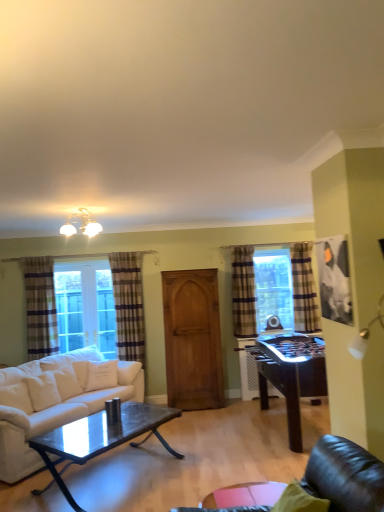
Describe the element at coordinates (304, 289) in the screenshot. I see `plaid fabric curtain at right, the fourth curtain positioned from the left` at that location.

What do you see at coordinates (243, 292) in the screenshot? I see `plaid fabric curtain at center, the 2th curtain when ordered from right to left` at bounding box center [243, 292].

Locate an element on the screen. wooden armoire at center is located at coordinates (192, 339).

Find the location of a particular element. The image size is (384, 512). plaid fabric curtain at left, arranged as the 1th curtain when viewed from the left is located at coordinates (40, 306).

The width and height of the screenshot is (384, 512). What do you see at coordinates (16, 397) in the screenshot?
I see `white soft pillow at lower left, acting as the 2th pillow starting from the back` at bounding box center [16, 397].

Locate an element on the screen. shiny dark wood coffee table at center is located at coordinates (101, 437).

The height and width of the screenshot is (512, 384). Identify the location of plaid fabric curtain at right, the fourth curtain positioned from the left. (304, 289).

The image size is (384, 512). There is a white fabric couch at lower left. What are the coordinates of `the 2nd pillow above it (from a real-world perspective)` in the screenshot? It's located at [x=101, y=375].

From a real-world perspective, is white cotton pillow at lower left, arranged as the 1th pillow when viewed from the back, located beneath white fabric couch at lower left?

No, from a real-world perspective, white cotton pillow at lower left, arranged as the 1th pillow when viewed from the back, is not under white fabric couch at lower left.

Is white cotton pillow at lower left, the second pillow when ordered from front to back, facing towards white fabric couch at lower left?

Yes, white cotton pillow at lower left, the second pillow when ordered from front to back, is turned towards white fabric couch at lower left.

Is white cotton pillow at lower left, placed as the first pillow when sorted from right to left, taller or shorter than white fabric couch at lower left?

In the image, white cotton pillow at lower left, placed as the first pillow when sorted from right to left, appears to be shorter than white fabric couch at lower left.

Where is `light fixture lying above the wooden armoire at center (from the image's perspective)`? Image resolution: width=384 pixels, height=512 pixels. light fixture lying above the wooden armoire at center (from the image's perspective) is located at coordinates (82, 225).

Is wooden armoire at center far away from matte white chandelier at upper center?

Yes, wooden armoire at center and matte white chandelier at upper center are quite far apart.

Considering the sizes of objects wooden armoire at center and matte white chandelier at upper center in the image provided, who is smaller, wooden armoire at center or matte white chandelier at upper center?

Smaller between the two is matte white chandelier at upper center.

Is transparent glass table at lower center located outside white cotton pillow at lower left, the second pillow when ordered from front to back?

Indeed, transparent glass table at lower center is completely outside white cotton pillow at lower left, the second pillow when ordered from front to back.

Is transparent glass table at lower center with white cotton pillow at lower left, placed as the first pillow when sorted from right to left?

They are not placed beside each other.

Is transparent glass table at lower center shorter than white cotton pillow at lower left, placed as the first pillow when sorted from right to left?

Yes, transparent glass table at lower center is shorter than white cotton pillow at lower left, placed as the first pillow when sorted from right to left.

Considering the sizes of objects transparent glass table at lower center and white cotton pillow at lower left, arranged as the second pillow when viewed from the left, in the image provided, who is wider, transparent glass table at lower center or white cotton pillow at lower left, arranged as the second pillow when viewed from the left,?

transparent glass table at lower center is wider.

Is plaid fabric curtain at left, arranged as the 1th curtain when viewed from the left, not inside transparent glass table at lower center?

plaid fabric curtain at left, arranged as the 1th curtain when viewed from the left, lies outside transparent glass table at lower center's area.

Which object is closer to the camera, plaid fabric curtain at left, the 4th curtain from the right, or transparent glass table at lower center?

transparent glass table at lower center is more forward.

How different are the orientations of plaid fabric curtain at left, the 4th curtain from the right, and transparent glass table at lower center in degrees?

180 degrees separate the facing orientations of plaid fabric curtain at left, the 4th curtain from the right, and transparent glass table at lower center.

Is transparent glass table at lower center at the back of plaid fabric curtain at left, the 4th curtain from the right?

No, transparent glass table at lower center is not at the back of plaid fabric curtain at left, the 4th curtain from the right.

What are the coordinates of `the 1st curtain behind the wooden armoire at center` in the screenshot? It's located at (40, 306).

Is wooden armoire at center surrounded by plaid fabric curtain at left, arranged as the 1th curtain when viewed from the left?

No, wooden armoire at center is not surrounded by plaid fabric curtain at left, arranged as the 1th curtain when viewed from the left.

Is plaid fabric curtain at left, arranged as the 1th curtain when viewed from the left, wider than wooden armoire at center?

Incorrect, the width of plaid fabric curtain at left, arranged as the 1th curtain when viewed from the left, does not surpass that of wooden armoire at center.

Does point (31, 348) appear closer or farther from the camera than point (193, 292)?

Point (31, 348).

Is white cotton pillow at lower left, the second pillow when ordered from front to back, oriented towards plaid fabric curtain at right, the first curtain from the right?

No, white cotton pillow at lower left, the second pillow when ordered from front to back, is not turned towards plaid fabric curtain at right, the first curtain from the right.

Does white cotton pillow at lower left, arranged as the 1th pillow when viewed from the back, have a greater height compared to plaid fabric curtain at right, the first curtain from the right?

In fact, white cotton pillow at lower left, arranged as the 1th pillow when viewed from the back, may be shorter than plaid fabric curtain at right, the first curtain from the right.

Based on the photo, is white cotton pillow at lower left, arranged as the 1th pillow when viewed from the back, spatially inside plaid fabric curtain at right, the fourth curtain positioned from the left, or outside of it?

white cotton pillow at lower left, arranged as the 1th pillow when viewed from the back, is not enclosed by plaid fabric curtain at right, the fourth curtain positioned from the left.

Can you see white cotton pillow at lower left, placed as the first pillow when sorted from right to left, touching plaid fabric curtain at right, the first curtain from the right?

No, white cotton pillow at lower left, placed as the first pillow when sorted from right to left, is not beside plaid fabric curtain at right, the first curtain from the right.

From a real-world perspective, between transparent glass table at lower center and plaid fabric curtain at left, the third curtain in the right-to-left sequence, who is vertically lower?

transparent glass table at lower center.

Between point (223, 500) and point (136, 283), which one is positioned in front?

Positioned in front is point (223, 500).

In terms of width, does transparent glass table at lower center look wider or thinner when compared to plaid fabric curtain at left, positioned as the second curtain in left-to-right order?

transparent glass table at lower center is wider than plaid fabric curtain at left, positioned as the second curtain in left-to-right order.

Considering their positions, is transparent glass table at lower center located in front of or behind plaid fabric curtain at left, positioned as the second curtain in left-to-right order?

In the image, transparent glass table at lower center appears in front of plaid fabric curtain at left, positioned as the second curtain in left-to-right order.

At what (x,y) coordinates should I click in order to perform the action: click on the 2nd pillow behind the white fabric couch at lower left. Please return your answer as a coordinate pair (x, y). Looking at the image, I should click on (101, 375).

Locate an element on the screen. Image resolution: width=384 pixels, height=512 pixels. armoire below the matte white chandelier at upper center (from a real-world perspective) is located at coordinates (192, 339).

From the image, which object appears to be farther from transparent glass table at lower center, plaid fabric curtain at right, the first curtain from the right, or plaid fabric curtain at center, the 2th curtain when ordered from right to left?

Based on the image, plaid fabric curtain at center, the 2th curtain when ordered from right to left, appears to be further to transparent glass table at lower center.

From the image, which object appears to be nearer to plaid fabric curtain at left, arranged as the 1th curtain when viewed from the left, transparent glass table at lower center or plaid fabric curtain at left, the third curtain in the right-to-left sequence?

plaid fabric curtain at left, the third curtain in the right-to-left sequence, is positioned closer to the anchor plaid fabric curtain at left, arranged as the 1th curtain when viewed from the left.

Consider the image. Based on their spatial positions, is white cotton pillow at lower left, arranged as the second pillow when viewed from the left, or white soft pillow at lower left, arranged as the first pillow when viewed from the left, closer to wooden armoire at center?

white cotton pillow at lower left, arranged as the second pillow when viewed from the left, is positioned closer to the anchor wooden armoire at center.

Which object lies nearer to the anchor point plaid fabric curtain at right, the first curtain from the right, white cotton pillow at lower left, arranged as the 1th pillow when viewed from the back, or matte white chandelier at upper center?

white cotton pillow at lower left, arranged as the 1th pillow when viewed from the back, is positioned closer to the anchor plaid fabric curtain at right, the first curtain from the right.

From the image, which object appears to be farther from plaid fabric curtain at left, positioned as the second curtain in left-to-right order, plaid fabric curtain at center, the 2th curtain when ordered from right to left, or white cotton pillow at lower left, placed as the first pillow when sorted from right to left?

Among the two, plaid fabric curtain at center, the 2th curtain when ordered from right to left, is located further to plaid fabric curtain at left, positioned as the second curtain in left-to-right order.

When comparing their distances from white fabric couch at lower left, does plaid fabric curtain at right, the fourth curtain positioned from the left, or shiny dark wood coffee table at center seem further?

The object further to white fabric couch at lower left is plaid fabric curtain at right, the fourth curtain positioned from the left.

From the image, which object appears to be nearer to plaid fabric curtain at right, the fourth curtain positioned from the left, plaid fabric curtain at center, which is the 3th curtain from left to right, or wooden armoire at center?

The object closer to plaid fabric curtain at right, the fourth curtain positioned from the left, is plaid fabric curtain at center, which is the 3th curtain from left to right.

From the image, which object appears to be farther from white soft pillow at lower left, acting as the 2th pillow starting from the back, matte white chandelier at upper center or wooden armoire at center?

Based on the image, wooden armoire at center appears to be further to white soft pillow at lower left, acting as the 2th pillow starting from the back.

You are a GUI agent. You are given a task and a screenshot of the screen. Output one action in this format:
    pyautogui.click(x=<x>, y=<y>)
    Task: Click on the glass table that lies between matte white chandelier at upper center and shiny dark wood coffee table at center from top to bottom
    Image resolution: width=384 pixels, height=512 pixels.
    Given the screenshot: What is the action you would take?
    pyautogui.click(x=244, y=495)

You are a GUI agent. You are given a task and a screenshot of the screen. Output one action in this format:
    pyautogui.click(x=<x>, y=<y>)
    Task: Click on the curtain located between white fabric couch at lower left and plaid fabric curtain at left, positioned as the second curtain in left-to-right order, in the depth direction
    
    Given the screenshot: What is the action you would take?
    pyautogui.click(x=40, y=306)

You are a GUI agent. You are given a task and a screenshot of the screen. Output one action in this format:
    pyautogui.click(x=<x>, y=<y>)
    Task: Click on the studio couch between plaid fabric curtain at left, arranged as the 1th curtain when viewed from the left, and plaid fabric curtain at center, which is the 3th curtain from left to right, in the horizontal direction
    The image size is (384, 512).
    Given the screenshot: What is the action you would take?
    pyautogui.click(x=55, y=403)

Identify the location of armoire positioned between shiny dark wood coffee table at center and plaid fabric curtain at left, the 4th curtain from the right, from near to far. (192, 339).